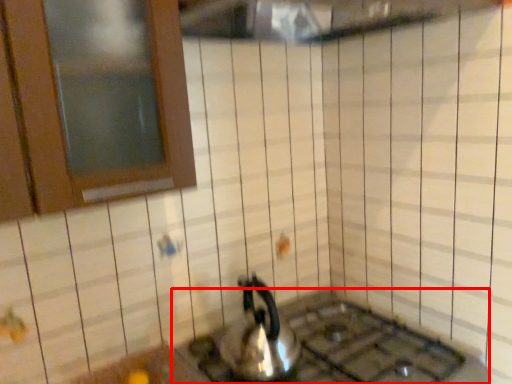
Question: From the image's perspective, considering the relative positions of gas stove (annotated by the red box) and kettle in the image provided, where is gas stove (annotated by the red box) located with respect to the staircase?

Choices:
 (A) above
 (B) below

Answer: (B)